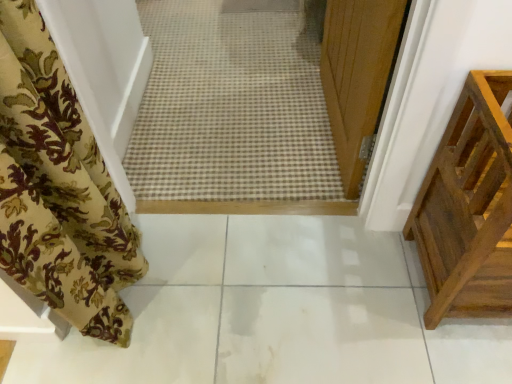
Where is `vacant area that lies between brown wooden crate at right and floral fabric curtain at left`? This screenshot has height=384, width=512. vacant area that lies between brown wooden crate at right and floral fabric curtain at left is located at coordinates (276, 278).